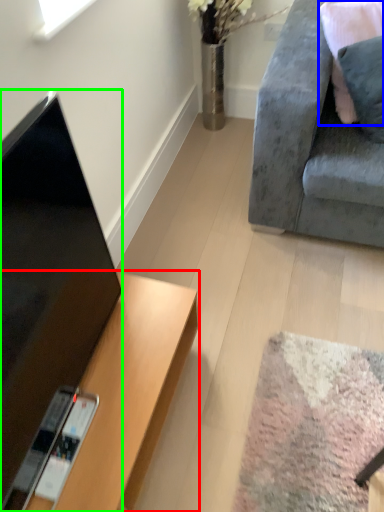
Question: Which object is the closest to the desk (highlighted by a red box)? Choose among these: pillow (highlighted by a blue box) or television (highlighted by a green box).

Choices:
 (A) pillow
 (B) television

Answer: (B)